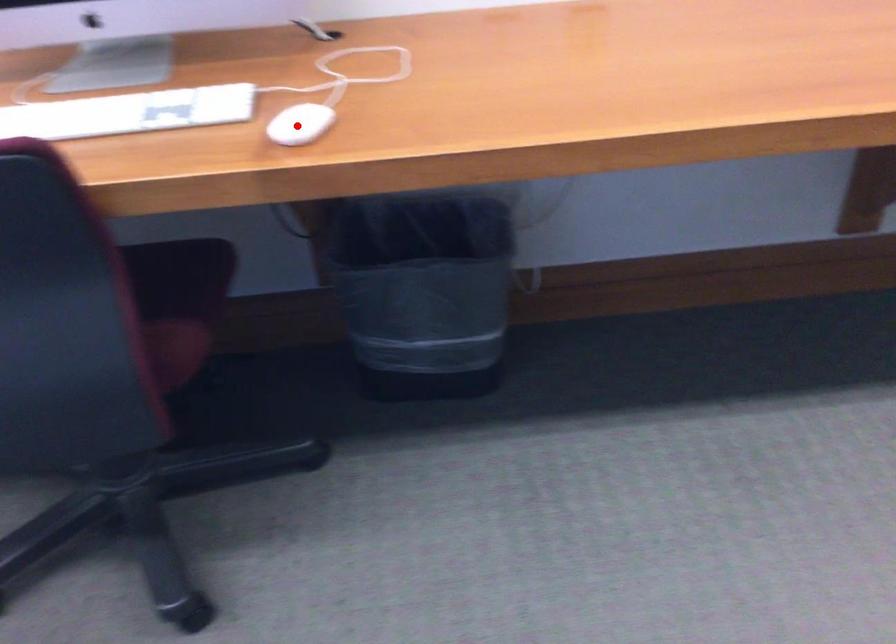
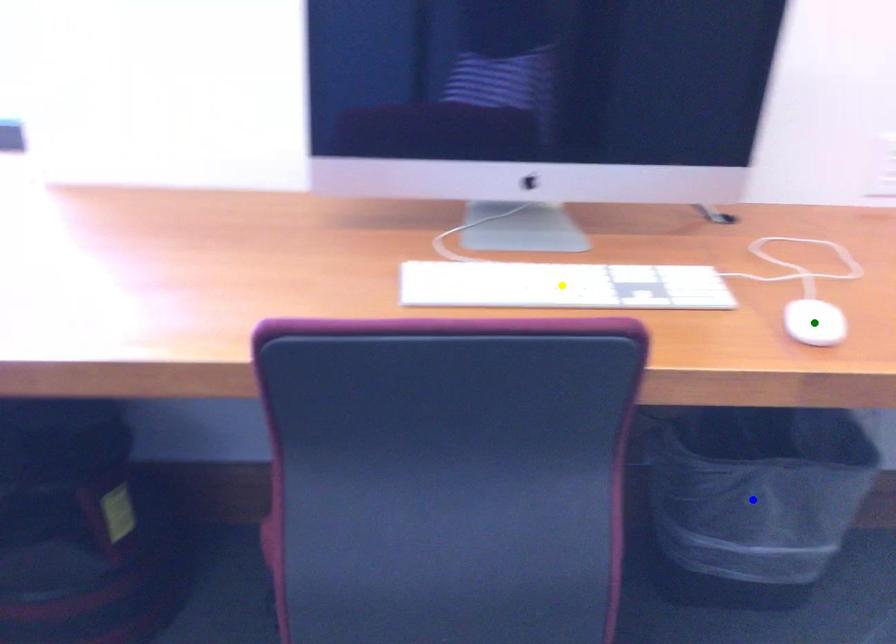
Question: I am providing you with two images of the same scene from different viewpoints. A red point is marked on the first image. You are given multiple points on the second image. In image 2, which mark is for the same physical point as the one in image 1?

Choices:
 (A) blue point
 (B) yellow point
 (C) green point

Answer: (C)